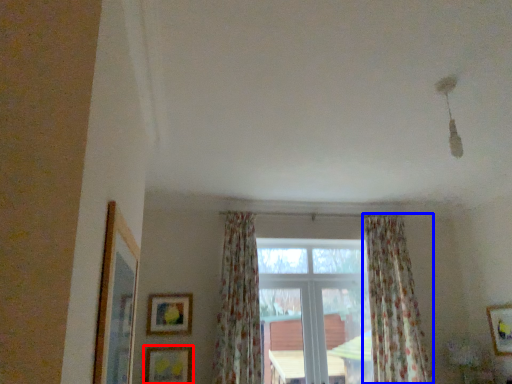
Question: Among these objects, which one is nearest to the camera, picture frame (highlighted by a red box) or curtain (highlighted by a blue box)?

Choices:
 (A) picture frame
 (B) curtain

Answer: (B)